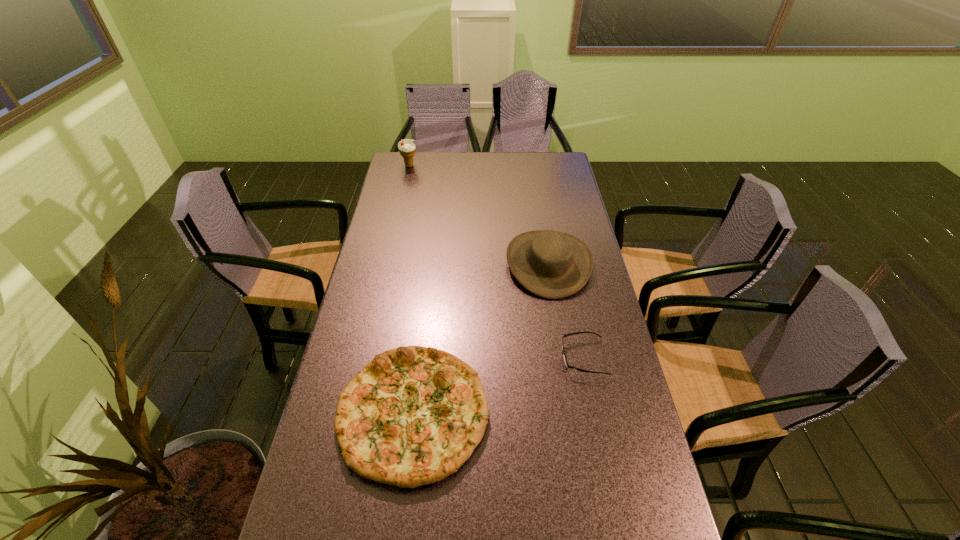
The width and height of the screenshot is (960, 540). I want to click on free space located on the front-facing side of the sunglasses, so click(x=470, y=357).

You are a GUI agent. You are given a task and a screenshot of the screen. Output one action in this format:
    pyautogui.click(x=<x>, y=<y>)
    Task: Click on the free location located on the front-facing side of the sunglasses
    Image resolution: width=960 pixels, height=540 pixels.
    Given the screenshot: What is the action you would take?
    pyautogui.click(x=449, y=357)

Identify the location of object located at the far edge. (406, 147).

At what (x,y) coordinates should I click in order to perform the action: click on icecream that is at the left edge. Please return your answer as a coordinate pair (x, y). Image resolution: width=960 pixels, height=540 pixels. Looking at the image, I should click on (406, 147).

Find the location of a particular element. This screenshot has width=960, height=540. pizza located in the left edge section of the desktop is located at coordinates (412, 416).

I want to click on cowboy hat that is at the right edge, so click(550, 264).

Where is `sunglasses at the right edge`? This screenshot has width=960, height=540. sunglasses at the right edge is located at coordinates (567, 365).

At what (x,y) coordinates should I click in order to perform the action: click on object located at the far left corner. Please return your answer as a coordinate pair (x, y). This screenshot has width=960, height=540. Looking at the image, I should click on (406, 147).

Image resolution: width=960 pixels, height=540 pixels. What are the coordinates of `vacant space at the far edge of the desktop` in the screenshot? It's located at (516, 167).

I want to click on vacant space at the left edge of the desktop, so click(x=398, y=215).